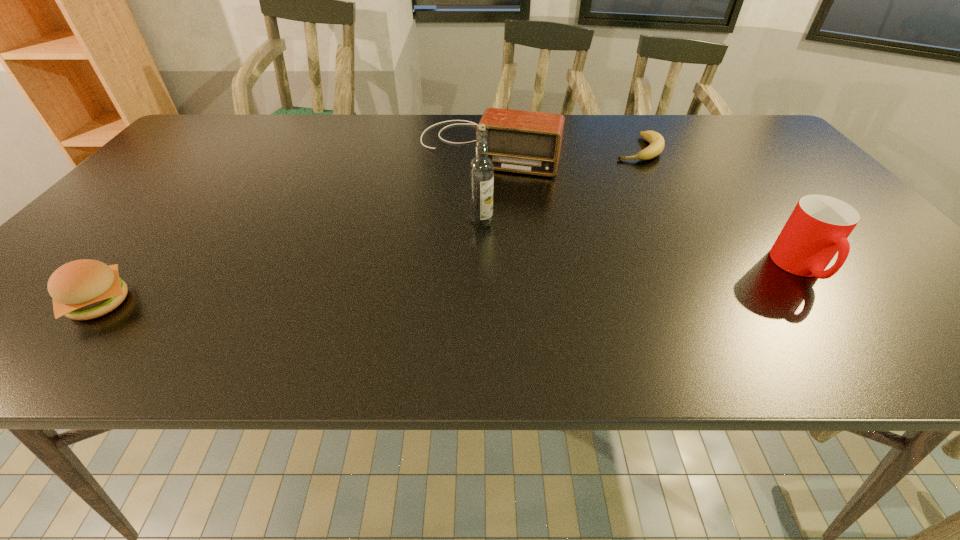
What are the coordinates of `hamburger that is at the near edge` in the screenshot? It's located at (85, 289).

Image resolution: width=960 pixels, height=540 pixels. Identify the location of cup that is at the near edge. (818, 228).

Locate an element on the screen. object present at the left edge is located at coordinates [85, 289].

Locate an element on the screen. object positioned at the near left corner is located at coordinates (85, 289).

Where is `vacant area at the far edge of the desktop`? This screenshot has height=540, width=960. vacant area at the far edge of the desktop is located at coordinates (576, 127).

Image resolution: width=960 pixels, height=540 pixels. I want to click on vacant space at the left edge, so click(x=141, y=225).

In the image, there is a desktop. Find the location of `vacant region at the right edge`. vacant region at the right edge is located at coordinates (774, 157).

What are the coordinates of `vacant space at the far left corner of the desktop` in the screenshot? It's located at (196, 146).

This screenshot has width=960, height=540. Identify the location of free point at the far right corner. (758, 147).

The width and height of the screenshot is (960, 540). In order to click on free area in between the cup and the hamburger in this screenshot , I will do `click(450, 285)`.